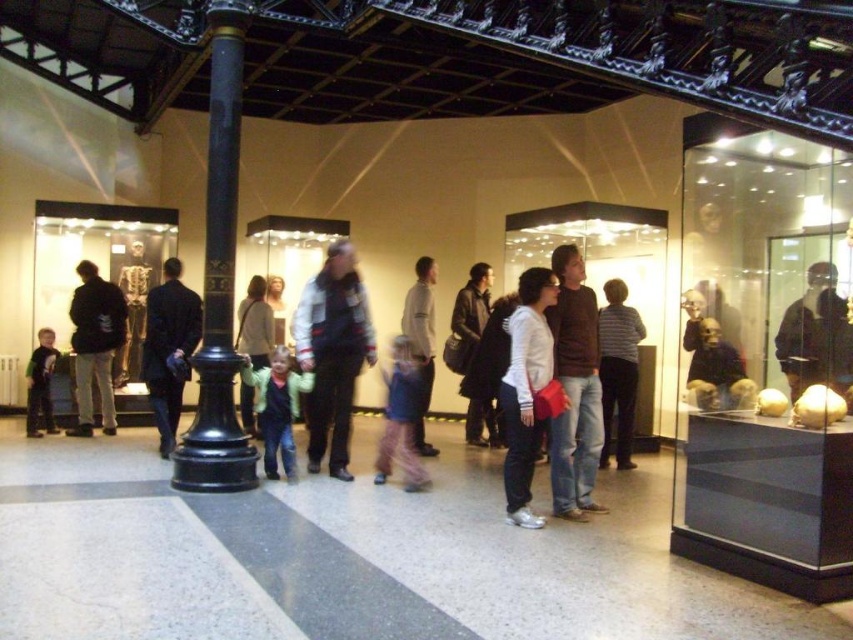
You are a visitor in the museum and want to take a photo of the gold metallic skeleton at center without the matte brown jacket at center blocking the view. Is the jacket in front of the skeleton?

Yes, the matte brown jacket at center is closer to the viewer than the gold metallic skeleton at center, so it is blocking the view of the skeleton.

In the museum scene, you see a striped sweater at center and a light green fleece jacket at center. Which one is positioned more to the right side?

The striped sweater at center is positioned to the right of the light green fleece jacket at center, so the striped sweater at center is more to the right side.